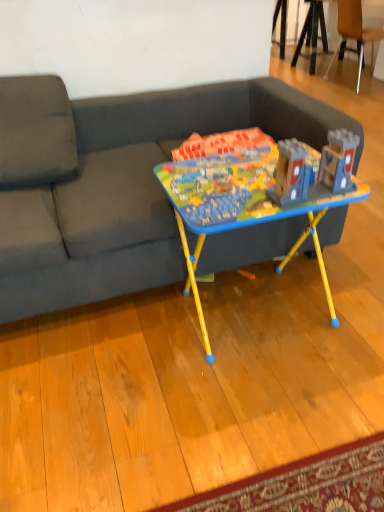
Question: From the image's perspective, relative to dark gray fabric couch at center, is wooden at upper right above or below?

Choices:
 (A) below
 (B) above

Answer: (B)

Question: Is wooden at upper right to the left or to the right of dark gray fabric couch at center in the image?

Choices:
 (A) left
 (B) right

Answer: (B)

Question: Which object is positioned farthest from the dark gray fabric couch at center?

Choices:
 (A) wooden at upper right
 (B) matte plastic table at center

Answer: (A)

Question: Which object is positioned farthest from the wooden at upper right?

Choices:
 (A) dark gray fabric couch at center
 (B) matte plastic table at center

Answer: (B)